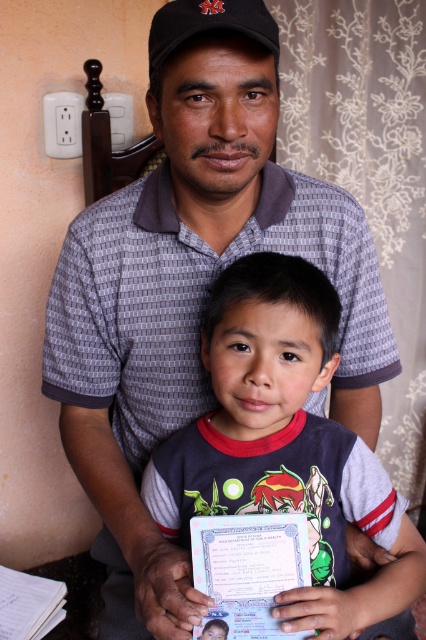
Question: Which of the following is the closest to the observer?

Choices:
 (A) dark gray cotton shirt at center
 (B) black matte baseball cap at upper center

Answer: (B)

Question: Observing the image, what is the correct spatial positioning of dark gray cotton shirt at center in reference to black matte baseball cap at upper center?

Choices:
 (A) above
 (B) below

Answer: (B)

Question: Can you confirm if dark gray cotton shirt at center is positioned to the left of black matte baseball cap at upper center?

Choices:
 (A) yes
 (B) no

Answer: (B)

Question: Can you confirm if dark gray cotton shirt at center is wider than black matte baseball cap at upper center?

Choices:
 (A) yes
 (B) no

Answer: (A)